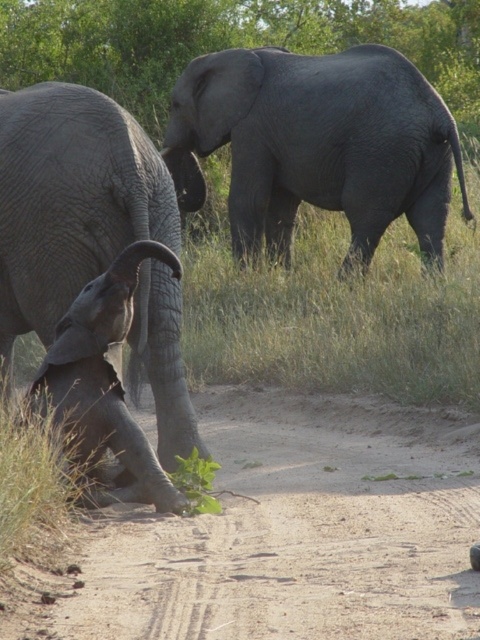
Question: Which point is farther to the camera?

Choices:
 (A) gray textured elephant at left
 (B) brown sandy dirt track at lower center

Answer: (A)

Question: Which point appears closest to the camera in this image?

Choices:
 (A) (95, 248)
 (B) (444, 177)
 (C) (224, 538)
 (D) (145, 497)

Answer: (C)

Question: Is gray textured elephant at left closer to the viewer compared to gray wrinkled baby elephant at lower left?

Choices:
 (A) no
 (B) yes

Answer: (A)

Question: Which point is farther to the camera?

Choices:
 (A) gray matte elephant at upper center
 (B) brown sandy dirt track at lower center

Answer: (A)

Question: Is brown sandy dirt track at lower center to the right of gray textured elephant at left from the viewer's perspective?

Choices:
 (A) yes
 (B) no

Answer: (A)

Question: Observing the image, what is the correct spatial positioning of gray matte elephant at upper center in reference to gray textured elephant at left?

Choices:
 (A) right
 (B) left

Answer: (A)